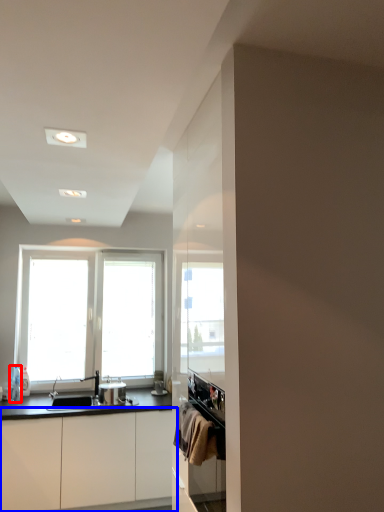
Question: Among these objects, which one is farthest to the camera, bottle (highlighted by a red box) or cabinetry (highlighted by a blue box)?

Choices:
 (A) bottle
 (B) cabinetry

Answer: (A)